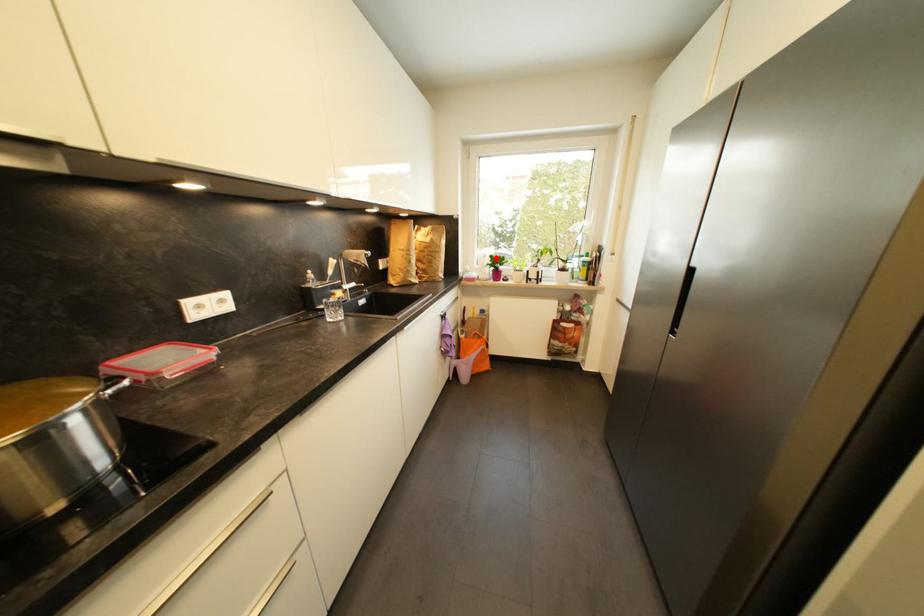
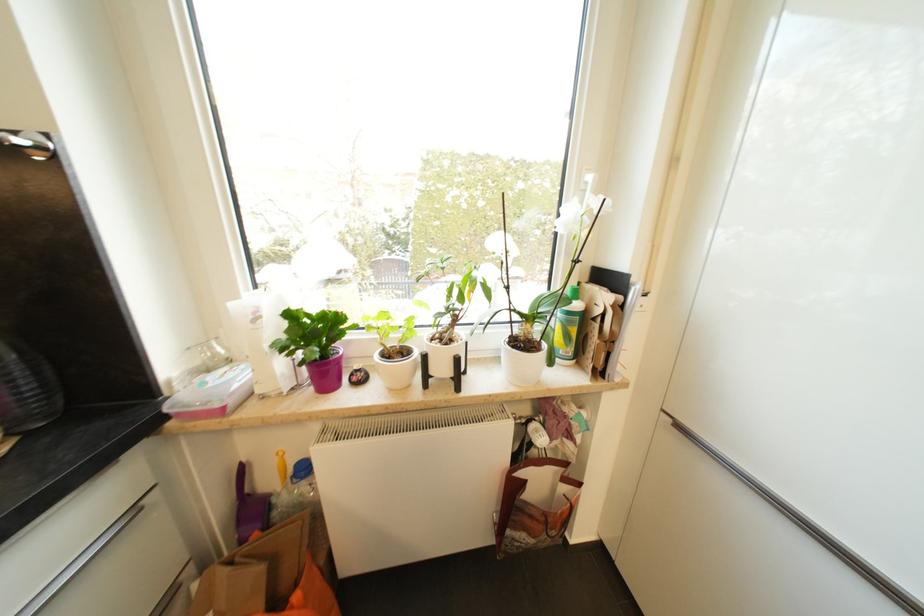
Question: I am providing you with two images of the same scene from different viewpoints. A red point is shown in image1. For the corresponding object point in image2, is it positioned nearer or farther from the camera?

Choices:
 (A) Nearer
 (B) Farther

Answer: (B)